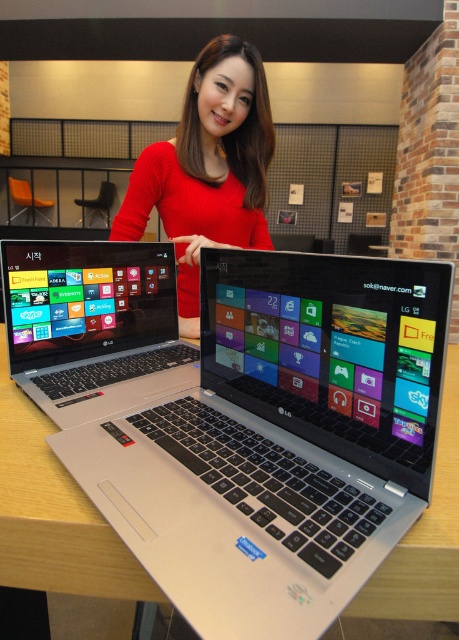
Question: Can you confirm if wooden table at center is bigger than silver metallic laptop at center?

Choices:
 (A) yes
 (B) no

Answer: (A)

Question: Can you confirm if wooden table at center is wider than silver metallic laptop at center?

Choices:
 (A) yes
 (B) no

Answer: (A)

Question: Which point is closer to the camera taking this photo?

Choices:
 (A) click(x=435, y=609)
 (B) click(x=174, y=170)
 (C) click(x=32, y=244)

Answer: (A)

Question: Among these points, which one is farthest from the camera?

Choices:
 (A) (134, 282)
 (B) (16, 502)

Answer: (A)

Question: Does wooden table at center appear over silver metallic laptop at center?

Choices:
 (A) yes
 (B) no

Answer: (B)

Question: Estimate the real-world distances between objects in this image. Which object is farther from the matte red sweater at center?

Choices:
 (A) silver metallic laptop at center
 (B) wooden table at center

Answer: (B)